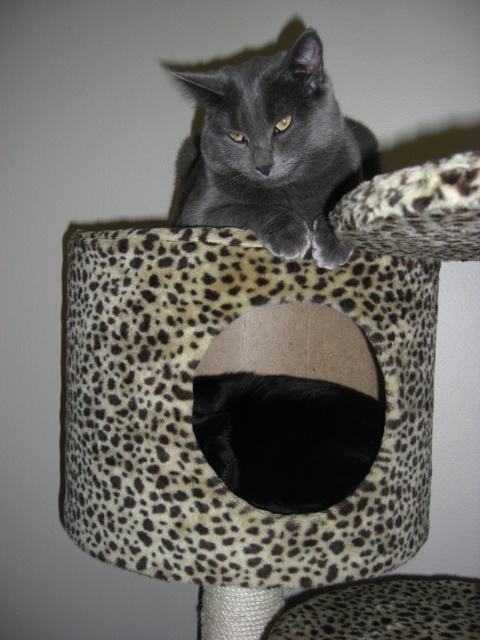
Question: Which point is closer to the camera taking this photo?

Choices:
 (A) (430, 582)
 (B) (350, 492)
 (C) (279, 138)
 (D) (456, 196)

Answer: (D)

Question: Estimate the real-world distances between objects in this image. Which object is farther from the black fur at center?

Choices:
 (A) leopard print fabric cat bed at upper center
 (B) matte gray cat at upper center
 (C) leopard print cat bed at center

Answer: (B)

Question: Is leopard print fabric cat bed at upper center further to camera compared to black fur at center?

Choices:
 (A) yes
 (B) no

Answer: (B)

Question: Among these points, which one is nearest to the camera?

Choices:
 (A) pyautogui.click(x=228, y=92)
 (B) pyautogui.click(x=144, y=504)
 (C) pyautogui.click(x=359, y=428)

Answer: (B)

Question: Is matte gray cat at upper center further to camera compared to black fur at center?

Choices:
 (A) no
 (B) yes

Answer: (A)

Question: Is matte gray cat at upper center to the right of leopard print cat bed at center from the viewer's perspective?

Choices:
 (A) yes
 (B) no

Answer: (B)